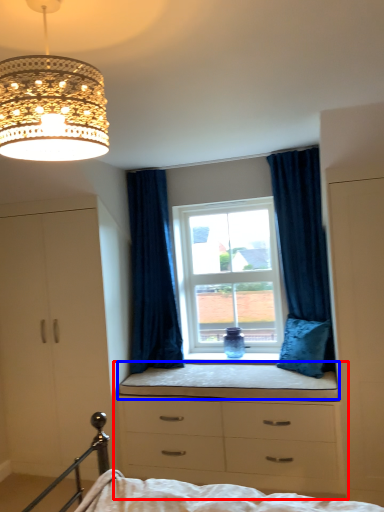
Question: Among these objects, which one is nearest to the camera, chest of drawers (highlighted by a red box) or window sill (highlighted by a blue box)?

Choices:
 (A) chest of drawers
 (B) window sill

Answer: (A)